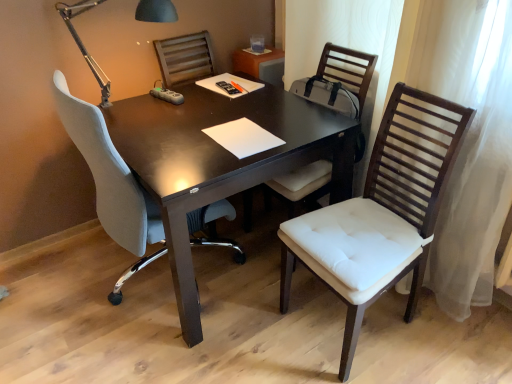
Question: Is white padded chair at right, the 3th chair from the left, aimed at dark wood table at center?

Choices:
 (A) no
 (B) yes

Answer: (A)

Question: From a real-world perspective, is white padded chair at right, the 3th chair from the left, positioned under dark wood table at center based on gravity?

Choices:
 (A) no
 (B) yes

Answer: (A)

Question: Considering the relative sizes of white padded chair at right, the 3th chair from the left, and dark wood table at center in the image provided, is white padded chair at right, the 3th chair from the left, shorter than dark wood table at center?

Choices:
 (A) yes
 (B) no

Answer: (B)

Question: Is white padded chair at right, which is the 1th chair in right-to-left order, turned away from dark wood table at center?

Choices:
 (A) yes
 (B) no

Answer: (B)

Question: Can dark wood table at center be found inside white padded chair at right, the 3th chair from the left?

Choices:
 (A) no
 (B) yes

Answer: (A)

Question: Is white padded chair at right, the 3th chair from the left, at the left side of dark wood table at center?

Choices:
 (A) no
 (B) yes

Answer: (A)

Question: Are dark wood table at center and white padded chair at right, which is the 1th chair in right-to-left order, making contact?

Choices:
 (A) yes
 (B) no

Answer: (B)

Question: Does dark wood table at center have a greater height compared to white padded chair at right, which is the 1th chair in right-to-left order?

Choices:
 (A) yes
 (B) no

Answer: (B)

Question: From a real-world perspective, is dark wood table at center physically below white padded chair at right, which is the 1th chair in right-to-left order?

Choices:
 (A) no
 (B) yes

Answer: (B)

Question: From the image's perspective, is dark wood table at center beneath white padded chair at right, the 3th chair from the left?

Choices:
 (A) yes
 (B) no

Answer: (B)

Question: Does dark wood table at center lie in front of white padded chair at right, which is the 1th chair in right-to-left order?

Choices:
 (A) yes
 (B) no

Answer: (B)

Question: Is dark wood table at center oriented away from white padded chair at right, the 3th chair from the left?

Choices:
 (A) yes
 (B) no

Answer: (B)

Question: Is white fabric chair at left, the 3th chair when ordered from right to left, at the back of matte black table lamp at upper left?

Choices:
 (A) yes
 (B) no

Answer: (A)